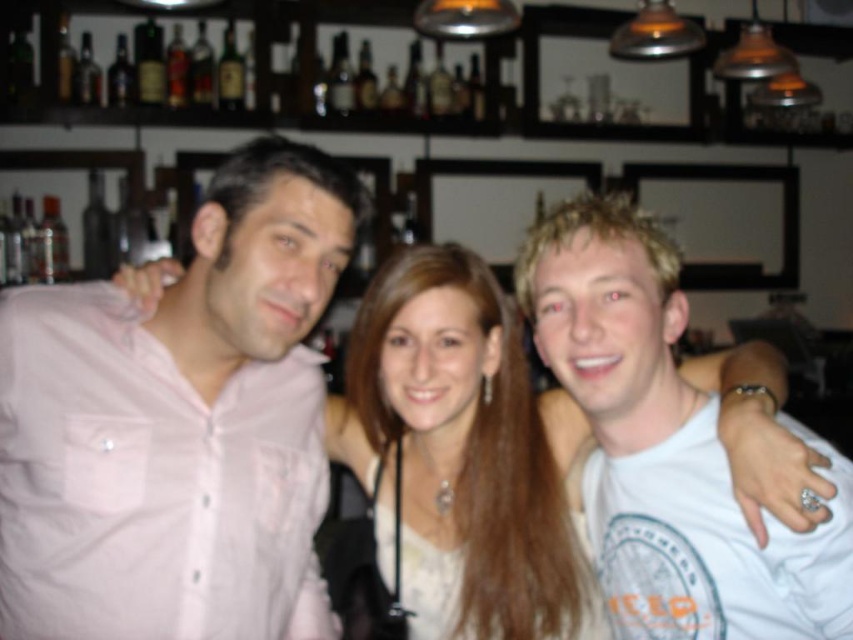
Question: Which is nearer to the matte white shirt at center?

Choices:
 (A) white cotton t-shirt at center
 (B) pink cotton shirt at left

Answer: (A)

Question: Which point is farther from the camera taking this photo?

Choices:
 (A) (465, 500)
 (B) (300, 308)
 (C) (766, 637)

Answer: (A)

Question: Based on their relative distances, which object is nearer to the matte white shirt at center?

Choices:
 (A) white cotton t-shirt at center
 (B) pink cotton shirt at left

Answer: (A)

Question: In this image, where is white cotton t-shirt at center located relative to matte white shirt at center?

Choices:
 (A) right
 (B) left

Answer: (A)

Question: Is pink cotton shirt at left positioned behind white cotton t-shirt at center?

Choices:
 (A) yes
 (B) no

Answer: (A)

Question: Can you confirm if white cotton t-shirt at center is positioned to the right of matte white shirt at center?

Choices:
 (A) no
 (B) yes

Answer: (B)